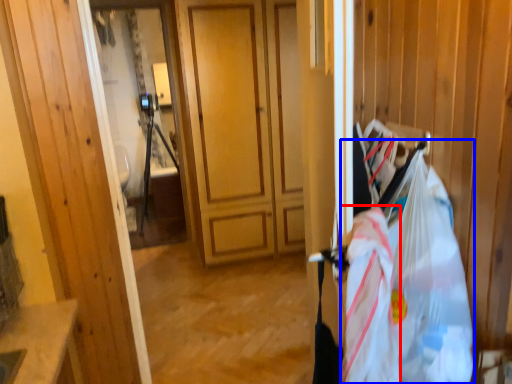
Question: Which object is closer to the camera taking this photo, grocery bag (highlighted by a red box) or grocery bag (highlighted by a blue box)?

Choices:
 (A) grocery bag
 (B) grocery bag

Answer: (B)